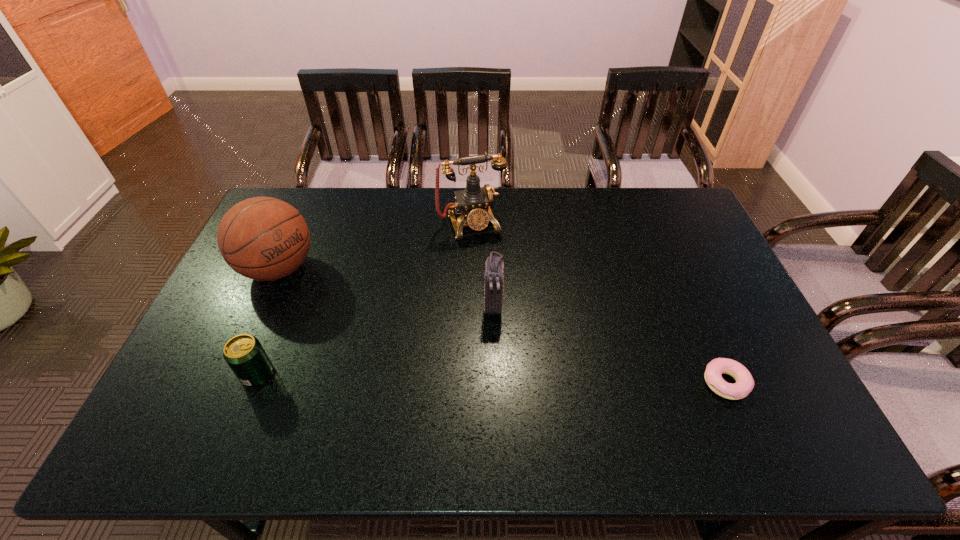
This screenshot has width=960, height=540. I want to click on vacant region located 0.110m on the side with brand label of the basketball, so click(326, 303).

You are a GUI agent. You are given a task and a screenshot of the screen. Output one action in this format:
    pyautogui.click(x=<x>, y=<y>)
    Task: Click on the vacant space located 0.090m with the zip open on the third shortest object
    The height and width of the screenshot is (540, 960).
    Given the screenshot: What is the action you would take?
    pyautogui.click(x=492, y=346)

What are the coordinates of `vacant space located with the zip open on the third shortest object` in the screenshot? It's located at (492, 337).

The width and height of the screenshot is (960, 540). What are the coordinates of `free location located with the zip open on the third shortest object` in the screenshot? It's located at (490, 379).

You are a GUI agent. You are given a task and a screenshot of the screen. Output one action in this format:
    pyautogui.click(x=<x>, y=<y>)
    Task: Click on the vacant space located on the front of the telephone, featuring the rotary dial
    The height and width of the screenshot is (540, 960).
    Given the screenshot: What is the action you would take?
    pyautogui.click(x=496, y=287)

Identify the location of vacant space located on the front of the telephone, featuring the rotary dial. The height and width of the screenshot is (540, 960). (500, 296).

Where is `free point located on the front of the telephone, featuring the rotary dial`? free point located on the front of the telephone, featuring the rotary dial is located at coordinates (493, 278).

In order to click on object located in the far edge section of the desktop in this screenshot , I will do `click(474, 202)`.

Where is `beer can positioned at the near edge`? The width and height of the screenshot is (960, 540). beer can positioned at the near edge is located at coordinates (244, 354).

Locate an element on the screen. Image resolution: width=960 pixels, height=540 pixels. doughnut located in the near edge section of the desktop is located at coordinates (744, 384).